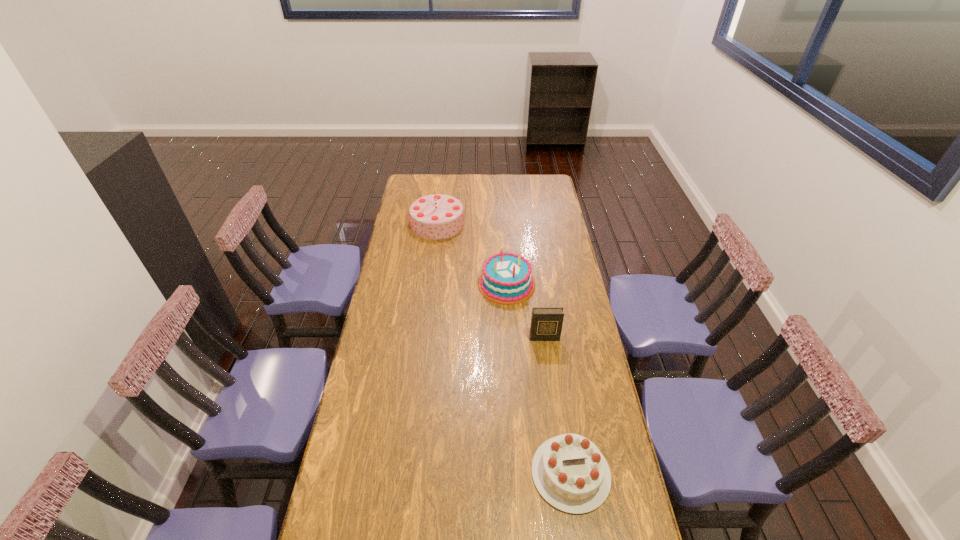
Identify which birthday cake is located as the second nearest to the second nearest birthday cake. Please provide its 2D coordinates. Your answer should be formatted as a tuple, i.e. [(x, y)], where the tuple contains the x and y coordinates of a point satisfying the conditions above.

[(571, 474)]

At what (x,y) coordinates should I click in order to perform the action: click on vacant space that satisfies the following two spatial constraints: 1. on the front side of the tallest birthday cake; 2. on the left side of the second nearest birthday cake. Please return your answer as a coordinate pair (x, y). The width and height of the screenshot is (960, 540). Looking at the image, I should click on (430, 284).

Locate an element on the screen. This screenshot has height=540, width=960. free space in the image that satisfies the following two spatial constraints: 1. on the front side of the third nearest object; 2. on the left side of the leftmost object is located at coordinates click(x=430, y=284).

Locate an element on the screen. This screenshot has width=960, height=540. vacant area that satisfies the following two spatial constraints: 1. on the front cover of the nearest birthday cake; 2. on the right side of the diary is located at coordinates (563, 473).

At what (x,y) coordinates should I click in order to perform the action: click on blank area in the image that satisfies the following two spatial constraints: 1. on the front cover of the second nearest object; 2. on the left side of the shortest birthday cake. Please return your answer as a coordinate pair (x, y). Looking at the image, I should click on (563, 473).

Identify the location of free space that satisfies the following two spatial constraints: 1. on the front side of the second farthest birthday cake; 2. on the left side of the shortest birthday cake. (518, 473).